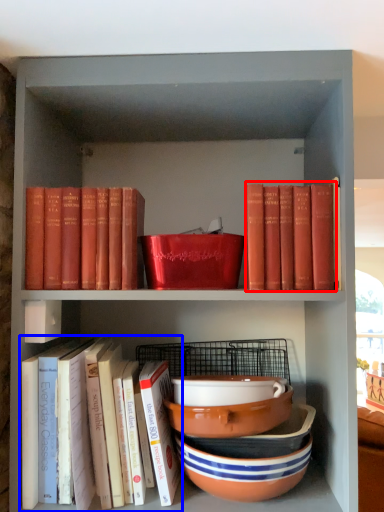
Question: Which object is further to the camera taking this photo, book (highlighted by a red box) or book (highlighted by a blue box)?

Choices:
 (A) book
 (B) book

Answer: (A)